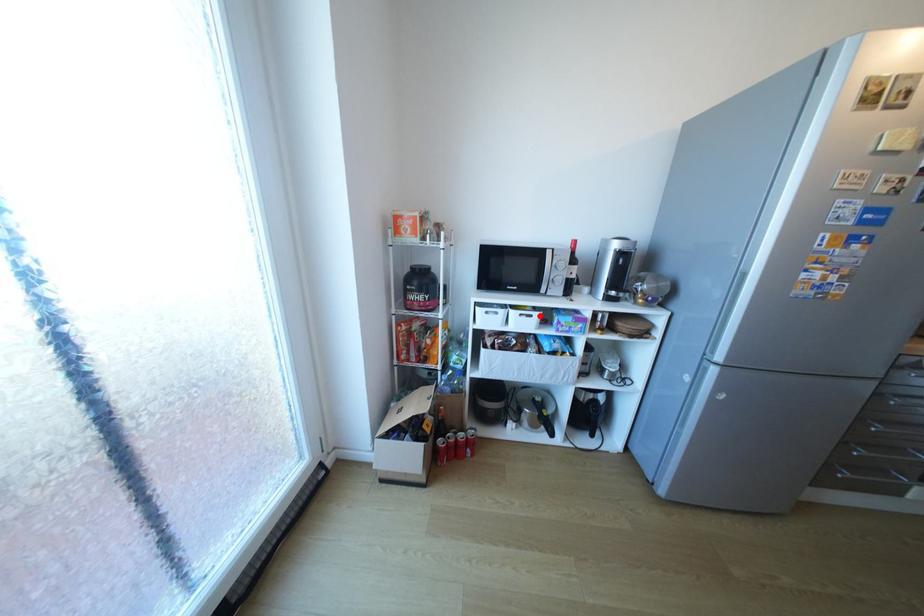
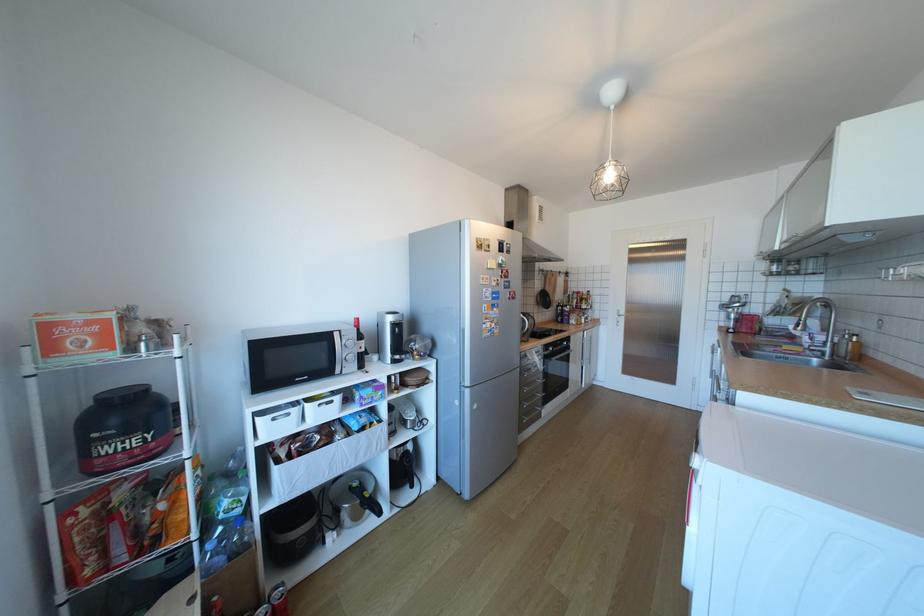
Locate, in the second image, the point that corresponds to the highlighted location in the first image.

(341, 402)